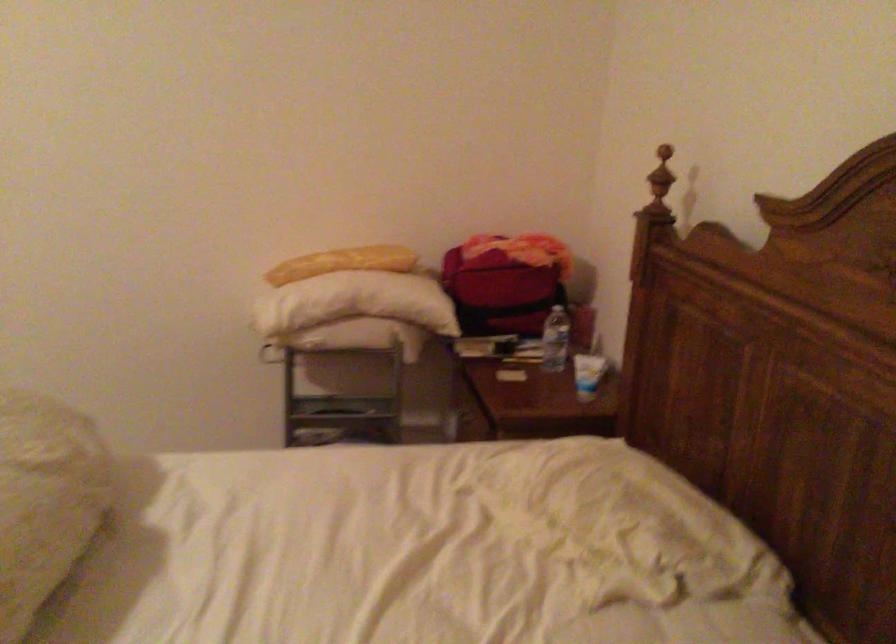
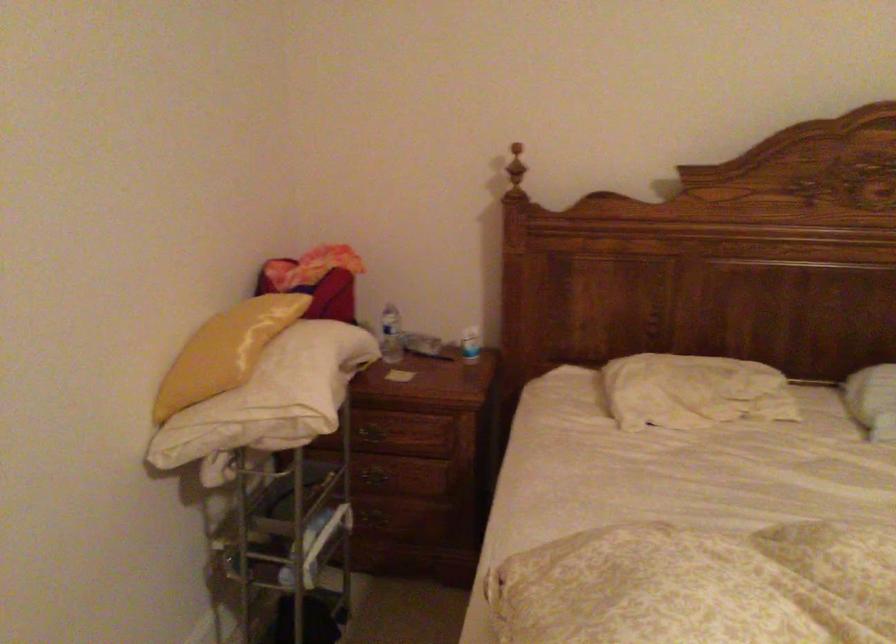
Where in the second image is the point corresponding to point 288,257 from the first image?

(225, 351)